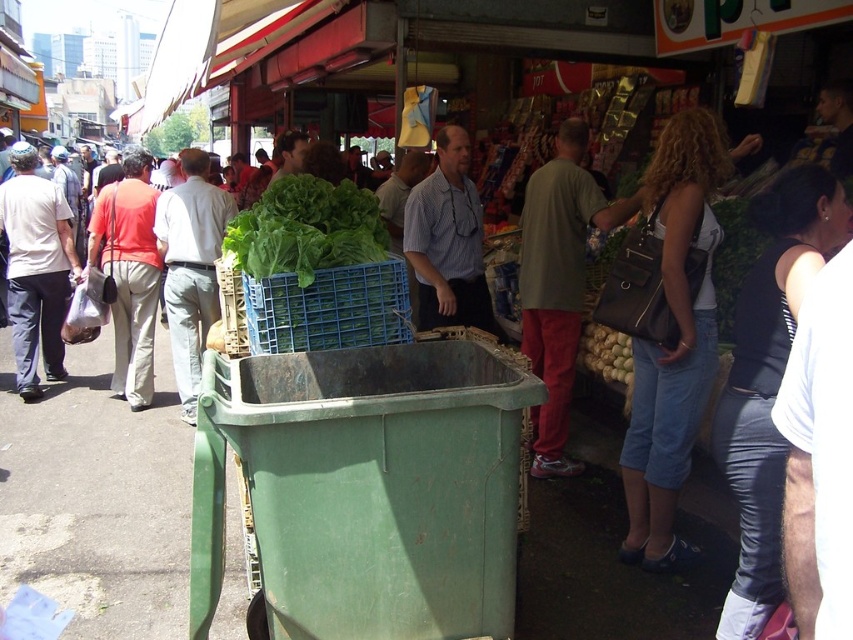
Question: Which point is farther to the camera?

Choices:
 (A) (108, 266)
 (B) (398, 198)

Answer: (A)

Question: Among these objects, which one is farthest from the camera?

Choices:
 (A) matte gray shirt at left
 (B) smooth brown shirt at center

Answer: (A)

Question: Where is white cotton shirt at left located in relation to green bamboo at center in the image?

Choices:
 (A) right
 (B) left

Answer: (B)

Question: Can you confirm if green leafy lettuce at center is smaller than matte gray shirt at left?

Choices:
 (A) yes
 (B) no

Answer: (A)

Question: Estimate the real-world distances between objects in this image. Which object is farther from the matte gray shirt at left?

Choices:
 (A) smooth brown shirt at center
 (B) matte orange shirt at left

Answer: (A)

Question: Does green leafy lettuce at center appear on the left side of green bamboo at center?

Choices:
 (A) no
 (B) yes

Answer: (B)